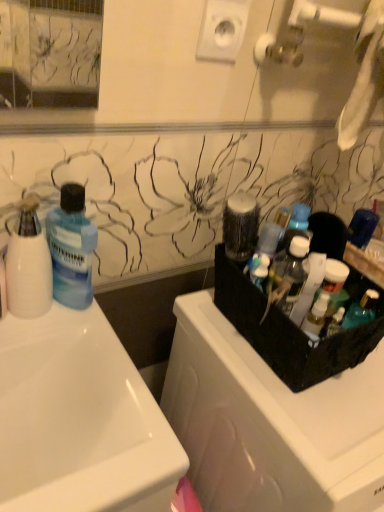
In order to click on vacant space in front of blue translucent liquid at left in this screenshot , I will do `click(84, 345)`.